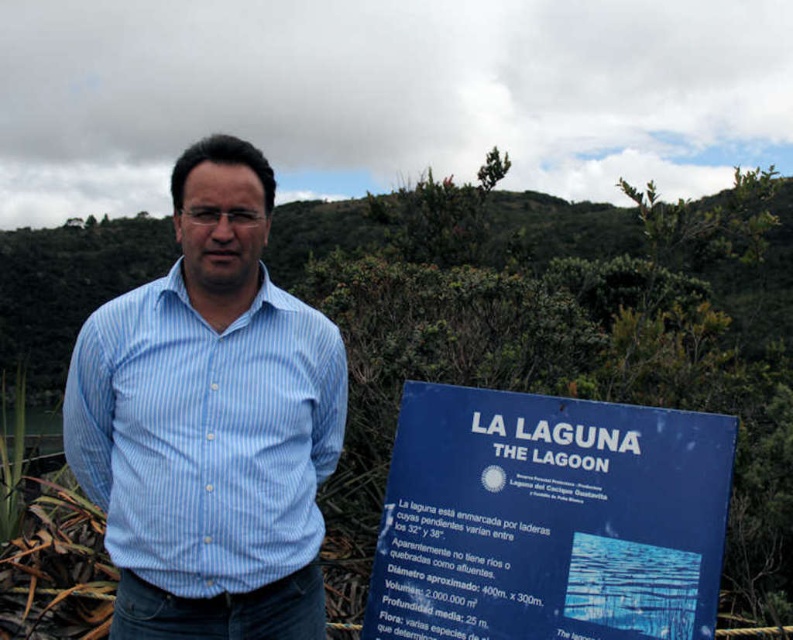
Question: Which point appears closest to the camera in this image?

Choices:
 (A) (221, 512)
 (B) (512, 589)

Answer: (A)

Question: Can you confirm if blue plastic sign at center is positioned to the right of blue striped shirt at center?

Choices:
 (A) yes
 (B) no

Answer: (A)

Question: Can you confirm if blue plastic sign at center is thinner than blue striped shirt at center?

Choices:
 (A) yes
 (B) no

Answer: (B)

Question: Is blue plastic sign at center wider than blue striped shirt at center?

Choices:
 (A) no
 (B) yes

Answer: (B)